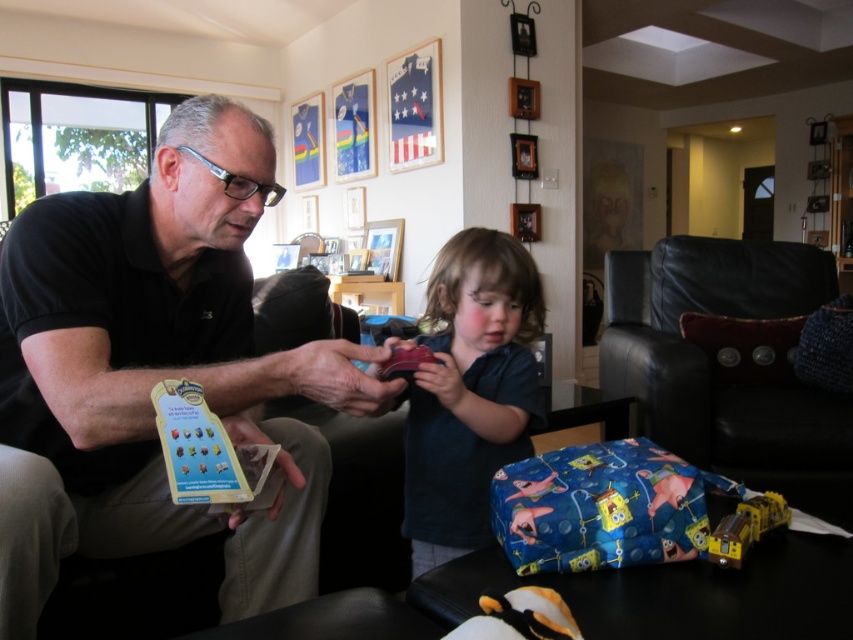
In the scene shown: You are a toy store employee who needs to place the rubberized plastic toy at center on a shelf. The shelf has a height restriction of 15 cm. Can the toy fit on the shelf if the dark blue shirt at center is 20 cm tall?

The dark blue shirt at center is taller than the rubberized plastic toy at center. Since the dark blue shirt at center is 20 cm tall, the rubberized plastic toy at center must be shorter than 20 cm. Therefore, the toy can fit on the shelf with a 15 cm height restriction.

You are a photographer setting up a shoot in the living room. You want to ensure both the matte black shirt at left and the dark blue shirt at center are visible in the frame. Given their height difference, which shirt should you position closer to the camera to maintain visibility?

The matte black shirt at left is much taller than the dark blue shirt at center, so you should position the dark blue shirt at center closer to the camera to ensure both are visible.

You are a parent trying to teach your child about toy cars. You are standing at point (119, 380). The child is sitting on the couch. Can you reach the child from your current position without moving your feet?

The distance between you at point (119, 380) and the child is 94.63 centimeters. Since the average arm span for an adult is about 1.5 meters, you can easily reach the child without moving your feet.